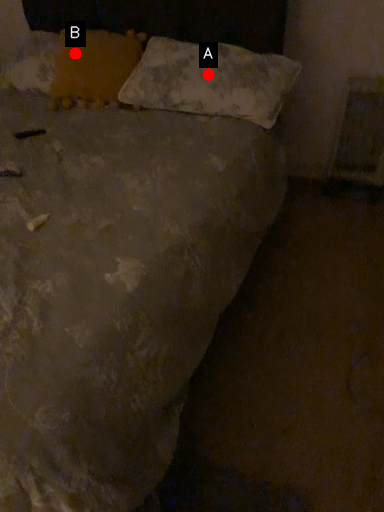
Question: Two points are circled on the image, labeled by A and B beside each circle. Which of the following is the farthest from the observer?

Choices:
 (A) A is further
 (B) B is further

Answer: (B)